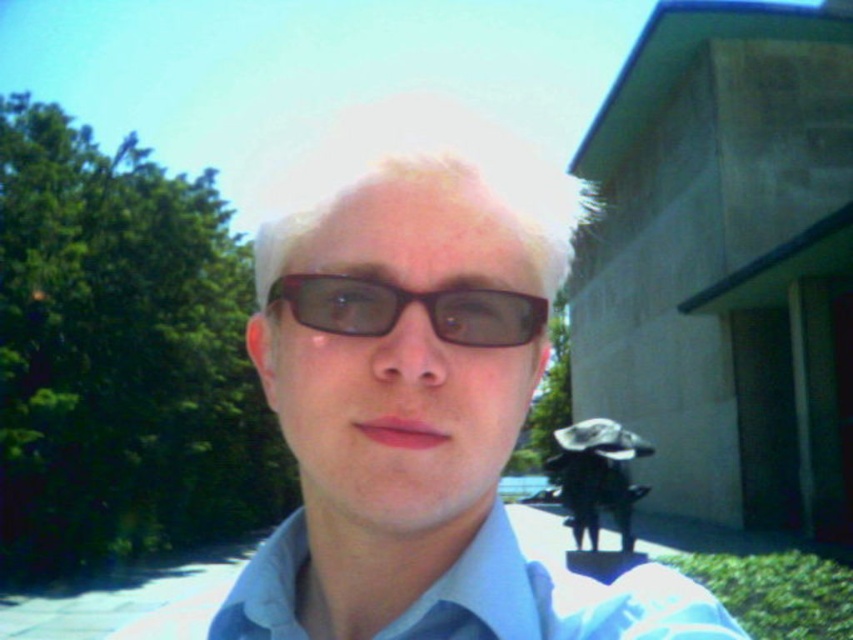
Does blonde hair at center have a larger size compared to shiny brown glasses at center?

Yes.

Is point (296, 160) behind point (494, 316)?

Yes, point (296, 160) is farther from viewer.

Where is `blonde hair at center`? The height and width of the screenshot is (640, 853). blonde hair at center is located at coordinates (424, 176).

In the scene shown: Which of these two, white cotton dress shirt at center or shiny brown glasses at center, stands shorter?

Standing shorter between the two is shiny brown glasses at center.

Can you confirm if white cotton dress shirt at center is positioned below shiny brown glasses at center?

Yes.

You are a GUI agent. You are given a task and a screenshot of the screen. Output one action in this format:
    pyautogui.click(x=<x>, y=<y>)
    Task: Click on the white cotton dress shirt at center
    This screenshot has height=640, width=853.
    Given the screenshot: What is the action you would take?
    pyautogui.click(x=555, y=598)

Is matte brown glasses at center taller than blonde hair at center?

Incorrect, matte brown glasses at center's height is not larger of blonde hair at center's.

Does matte brown glasses at center have a greater width compared to blonde hair at center?

No.

Identify the location of matte brown glasses at center. This screenshot has width=853, height=640. (421, 397).